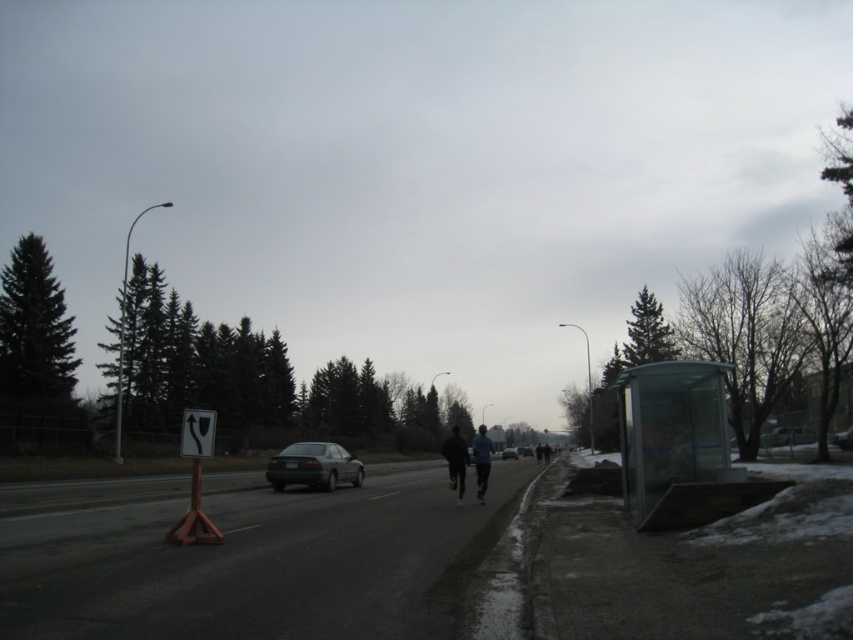
Question: Considering the real-world distances, which object is closest to the metallic gray sedan at center?

Choices:
 (A) transparent glass bus stop at right
 (B) dark matte jacket at center

Answer: (B)

Question: Is dark matte jacket at center positioned at the back of dark blue fabric jacket at center?

Choices:
 (A) no
 (B) yes

Answer: (A)

Question: Which point is closer to the camera?

Choices:
 (A) (508, 458)
 (B) (809, 442)
 (C) (474, 451)
 (D) (709, 388)

Answer: (D)

Question: Where is dark matte jacket at center located in relation to metallic silver sedan at center in the image?

Choices:
 (A) left
 (B) right

Answer: (A)

Question: Which point is closer to the camera?

Choices:
 (A) dark blue fabric jacket at center
 (B) metallic gray sedan at center
 (C) matte gray sedan at center

Answer: (A)

Question: Is transparent glass bus stop at right bigger than satin silver sedan at center?

Choices:
 (A) yes
 (B) no

Answer: (B)